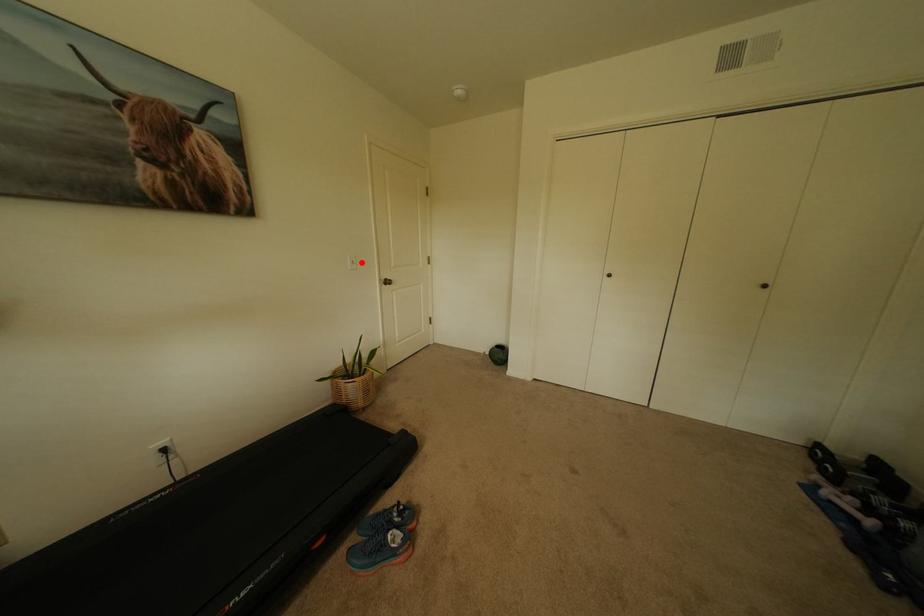
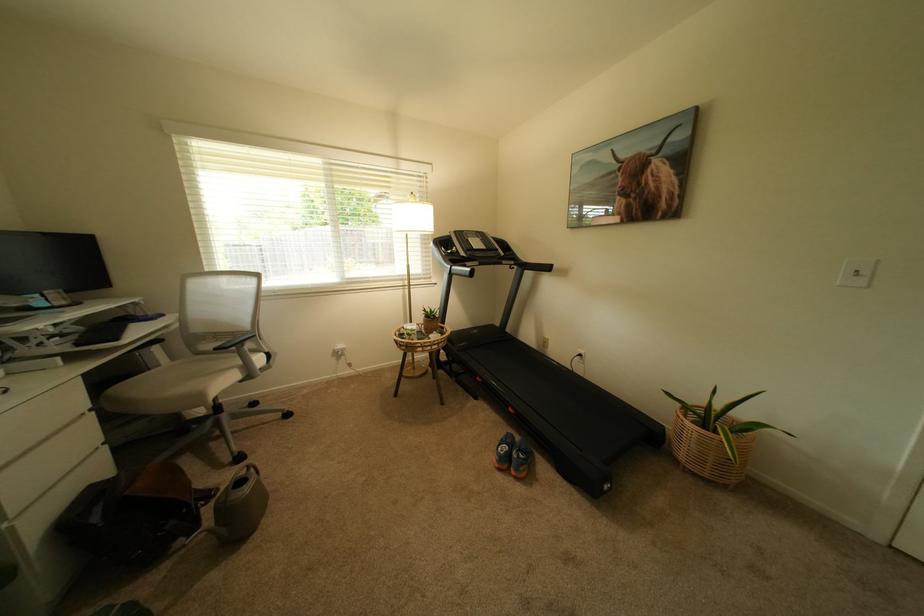
Where in the second image is the point corresponding to the highlighted location from the first image?

(866, 272)